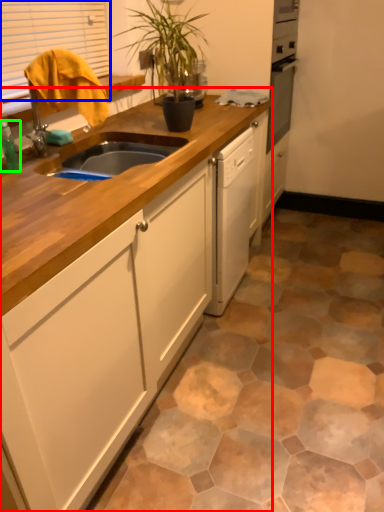
Question: Estimate the real-world distances between objects in this image. Which object is closer to cabinetry (highlighted by a red box), window (highlighted by a blue box) or bottle (highlighted by a green box)?

Choices:
 (A) window
 (B) bottle

Answer: (B)